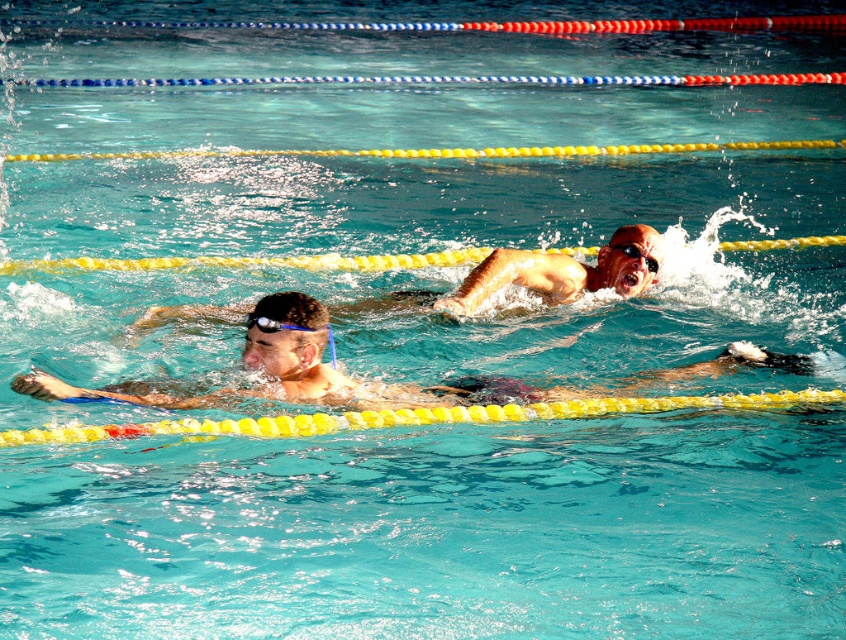
Question: Does smooth skin swimmer at center appear over black matte swim cap at upper center?

Choices:
 (A) yes
 (B) no

Answer: (B)

Question: Does smooth skin swimmer at center come in front of black matte swim cap at upper center?

Choices:
 (A) no
 (B) yes

Answer: (B)

Question: Is black matte swim cap at upper center above black rubber goggles at center?

Choices:
 (A) yes
 (B) no

Answer: (B)

Question: Which of the following is the closest to the observer?

Choices:
 (A) smooth skin swimmer at center
 (B) black matte swim cap at upper center

Answer: (A)

Question: Which point appears farthest from the camera in this image?

Choices:
 (A) (651, 284)
 (B) (629, 248)

Answer: (A)

Question: Which point is closer to the camera taking this photo?

Choices:
 (A) (624, 246)
 (B) (550, 269)
 (C) (345, 376)

Answer: (C)